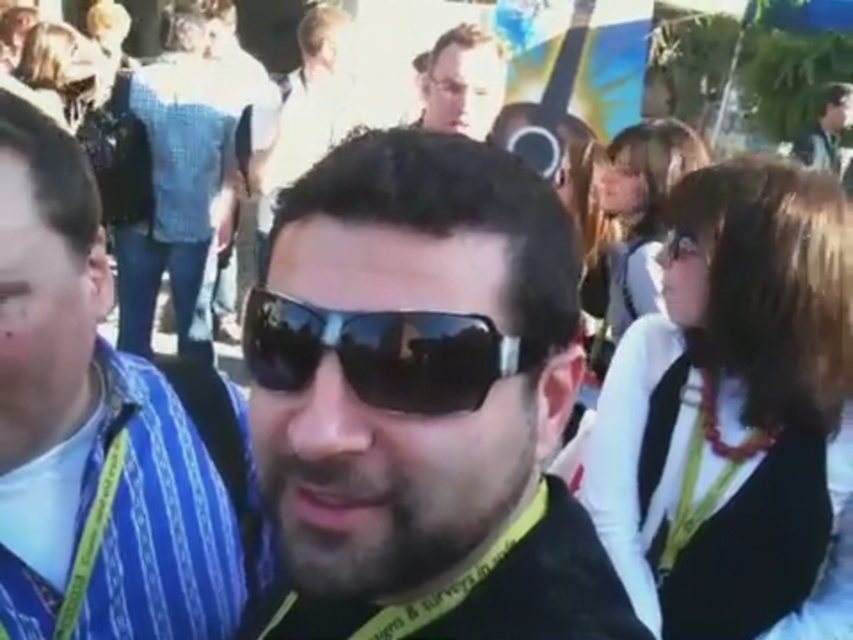
Question: Can you confirm if black matte sunglasses at center is positioned below black reflective sunglasses at center?

Choices:
 (A) yes
 (B) no

Answer: (A)

Question: Among these objects, which one is nearest to the camera?

Choices:
 (A) blue striped shirt at left
 (B) matte black hair at upper center
 (C) black matte sunglasses at center
 (D) black reflective sunglasses at center

Answer: (D)

Question: Observing the image, what is the correct spatial positioning of black reflective sunglasses at center in reference to matte black hair at upper center?

Choices:
 (A) above
 (B) below

Answer: (B)

Question: Can you confirm if black reflective sunglasses at center is positioned to the right of matte black hair at upper center?

Choices:
 (A) no
 (B) yes

Answer: (A)

Question: Which object is positioned closest to the black matte sunglasses at center?

Choices:
 (A) matte black hair at upper center
 (B) blue striped shirt at left

Answer: (B)

Question: Which object is positioned farthest from the black reflective sunglasses at center?

Choices:
 (A) blue striped shirt at left
 (B) black matte sunglasses at center

Answer: (A)